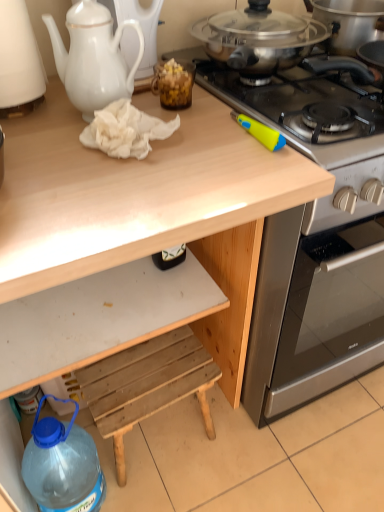
Identify the location of free area in between white porcelain teapot at upper left and white ceramic teapot at upper left. Image resolution: width=384 pixels, height=512 pixels. (55, 117).